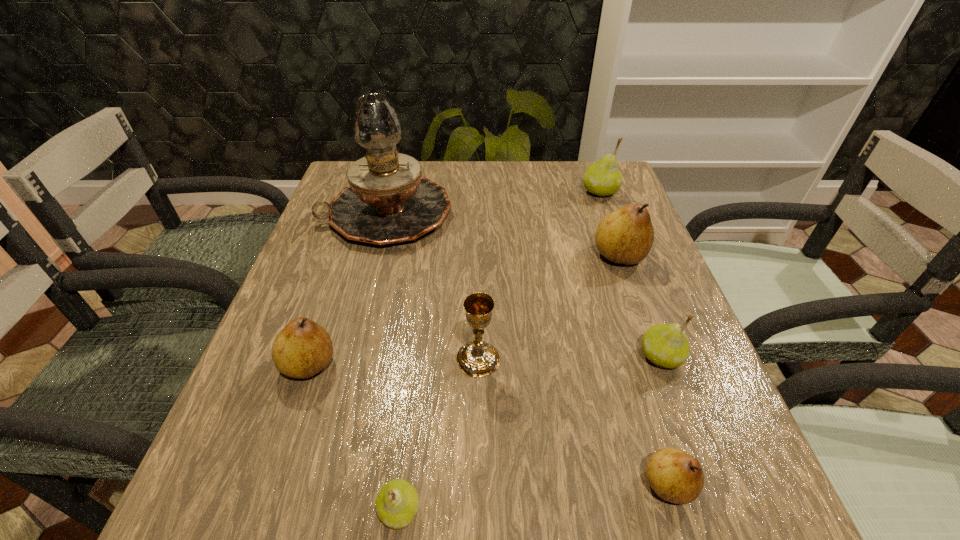
Where is `the tallest object`? This screenshot has width=960, height=540. the tallest object is located at coordinates (388, 201).

At what (x,y) coordinates should I click in order to perform the action: click on the biggest green pear. Please return your answer as a coordinate pair (x, y). The image size is (960, 540). Looking at the image, I should click on (603, 178).

You are a GUI agent. You are given a task and a screenshot of the screen. Output one action in this format:
    pyautogui.click(x=<x>, y=<y>)
    Task: Click on the farthest green pear
    
    Given the screenshot: What is the action you would take?
    pyautogui.click(x=603, y=178)

This screenshot has width=960, height=540. Identify the location of the farthest brown pear. (626, 235).

This screenshot has width=960, height=540. Identify the location of the fifth nearest pear. (626, 235).

The height and width of the screenshot is (540, 960). Identify the location of chalice. (477, 358).

The height and width of the screenshot is (540, 960). In order to click on the second nearest brown pear in this screenshot , I will do `click(303, 348)`.

Image resolution: width=960 pixels, height=540 pixels. I want to click on the leftmost pear, so click(x=303, y=348).

Find the location of a particular element. the second farthest green pear is located at coordinates (664, 345).

Where is `the smallest brown pear`? The width and height of the screenshot is (960, 540). the smallest brown pear is located at coordinates (676, 476).